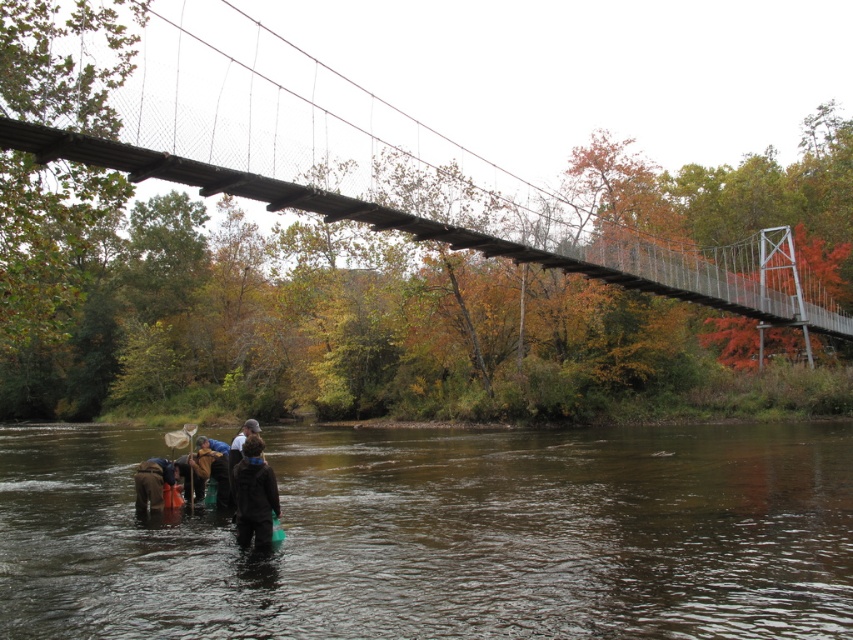
You are a researcher who needs to retrieve an item from the river. You see the dark brown jacket at lower center and the brown fabric at lower left. Which object is closer to you, the observer?

The dark brown jacket at lower center is closer to you because it is in front of the brown fabric at lower left.

You are a researcher standing on the riverbank and want to collect water samples from the brown murky water at lower center. Your dark brown leather boots at lower left are already in the water. Can you step forward to reach the water without getting your boots out of the water?

The brown murky water at lower center is located below dark brown leather boots at lower left, meaning your boots are already submerged in the water. Therefore, stepping forward would keep your boots in the water, allowing you to collect samples without needing to lift them out.

You are standing on the suspension bridge and want to take a photo of the brown murky water at lower center. Where should you point your camera to capture it in the frame?

To capture the brown murky water at lower center in your photo, point your camera towards the lower center area of the scene, specifically at the coordinates 0.838 on the x and 0.521 on the y axis.